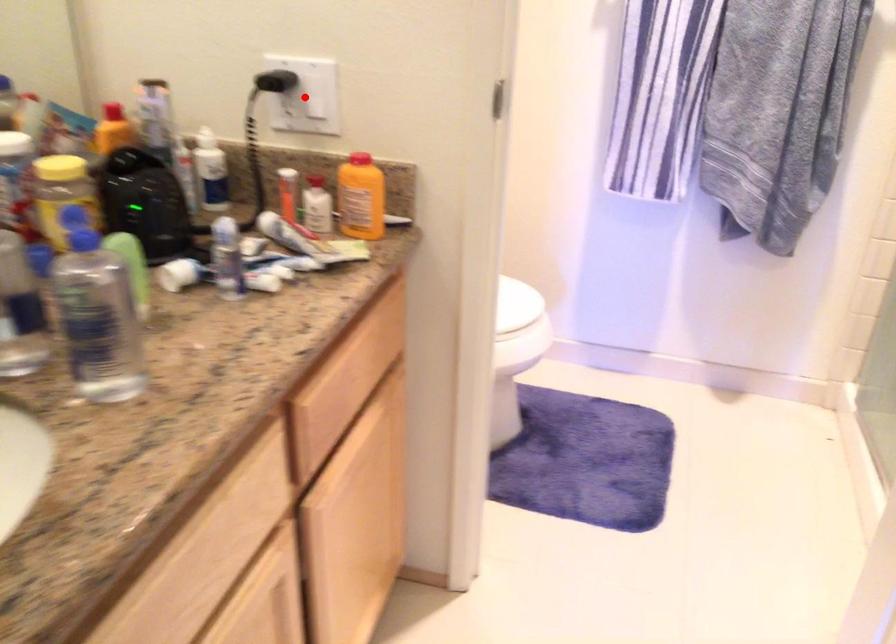
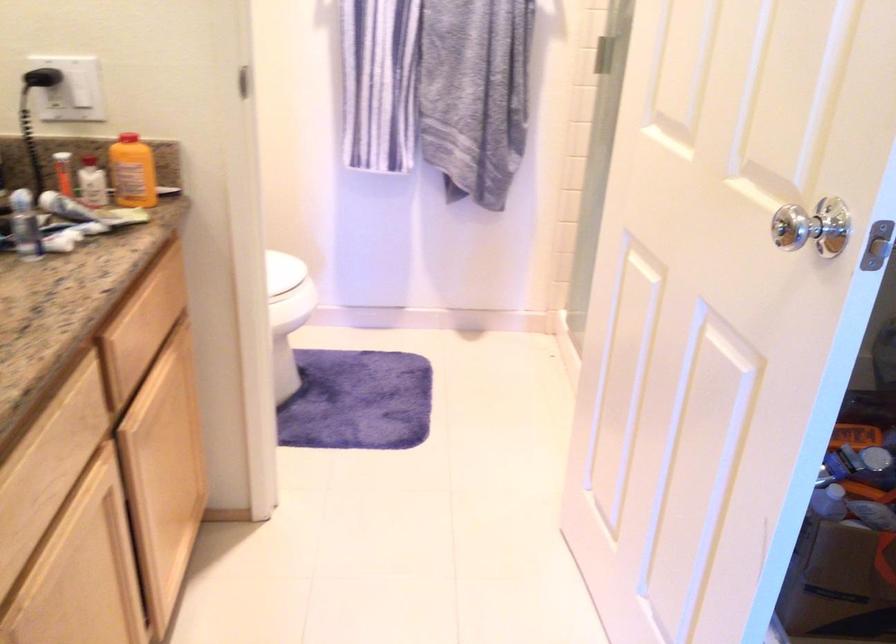
In the second image, find the point that corresponds to the highlighted location in the first image.

(76, 88)